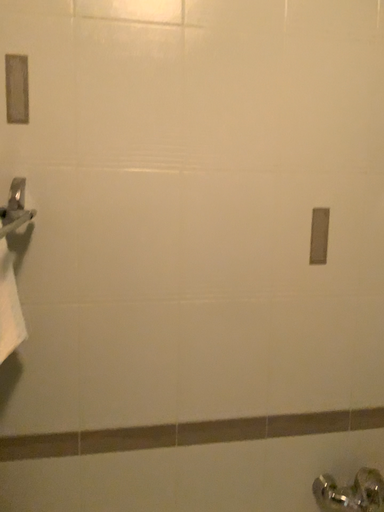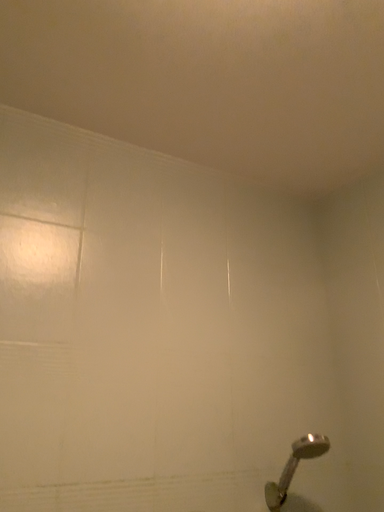
Question: How did the camera likely rotate when shooting the video?

Choices:
 (A) rotated downward
 (B) rotated upward

Answer: (B)